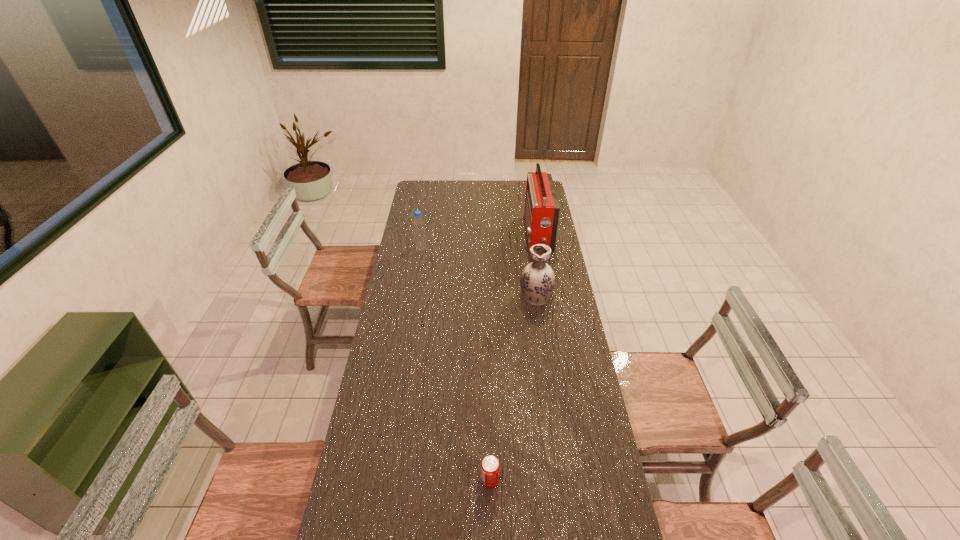
This screenshot has width=960, height=540. I want to click on free spot at the right edge of the desktop, so click(x=556, y=337).

Find the location of a particular element. The width and height of the screenshot is (960, 540). empty space between the soda and the tallest object is located at coordinates (514, 358).

The height and width of the screenshot is (540, 960). I want to click on vacant space in between the leftmost object and the soda, so click(x=456, y=365).

At what (x,y) coordinates should I click in order to perform the action: click on free space between the third object from right to left and the third farthest object. Please return your answer as a coordinate pair (x, y). This screenshot has width=960, height=540. Looking at the image, I should click on (513, 388).

Identify the location of free area in between the leftmost object and the shortest object. This screenshot has width=960, height=540. (456, 365).

Locate an element on the screen. This screenshot has width=960, height=540. free spot between the soda and the tallest object is located at coordinates (514, 358).

Where is `free space between the soda and the leftmost object`? This screenshot has height=540, width=960. free space between the soda and the leftmost object is located at coordinates (456, 365).

This screenshot has width=960, height=540. In order to click on free spot between the third object from right to left and the water bottle in this screenshot , I will do `click(456, 365)`.

Where is `empty space between the leftmost object and the second tallest object`? The width and height of the screenshot is (960, 540). empty space between the leftmost object and the second tallest object is located at coordinates (479, 272).

Locate an element on the screen. This screenshot has height=540, width=960. vacant area that lies between the tallest object and the water bottle is located at coordinates (479, 242).